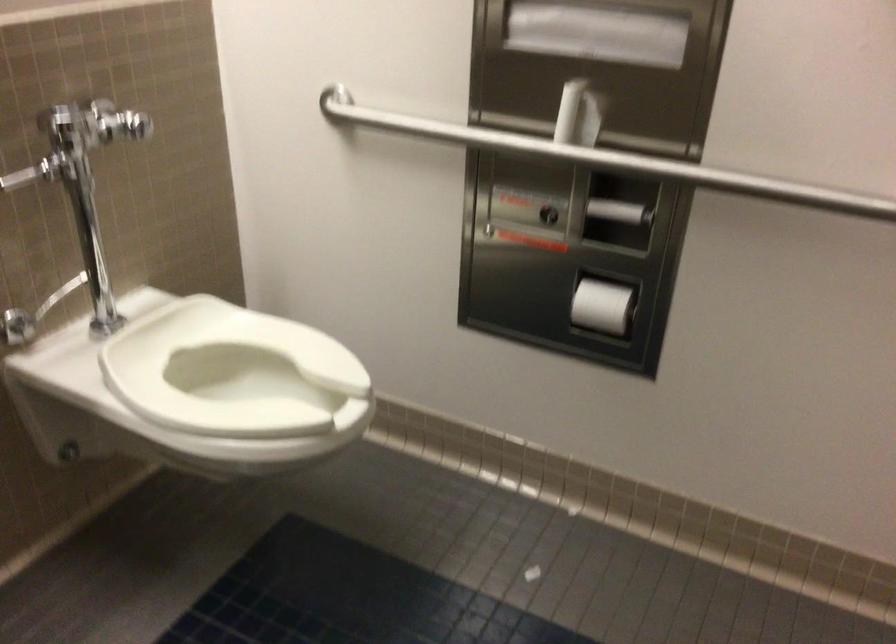
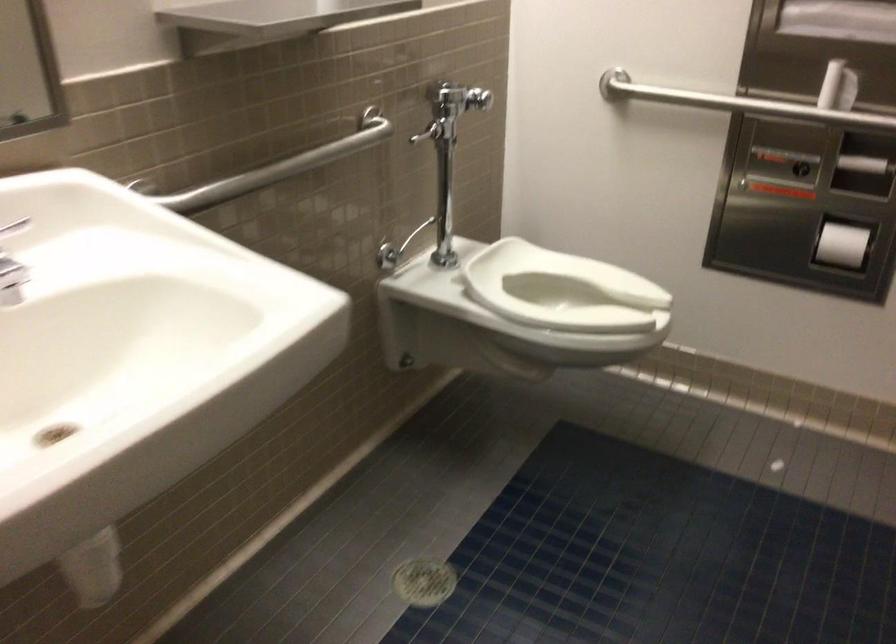
Question: I am providing you with two images of the same scene from different viewpoints. After the viewpoint changes to image2, which objects are now occluded?

Choices:
 (A) faucet handle
 (B) toilet flush lever
 (C) white toilet seat
 (D) none of these

Answer: (D)